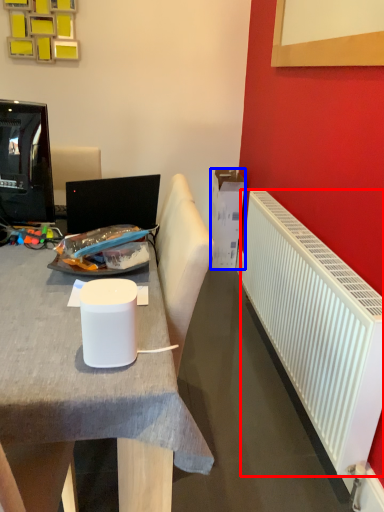
Question: Which object appears farthest to the camera in this image, radiator (highlighted by a red box) or box (highlighted by a blue box)?

Choices:
 (A) radiator
 (B) box

Answer: (B)